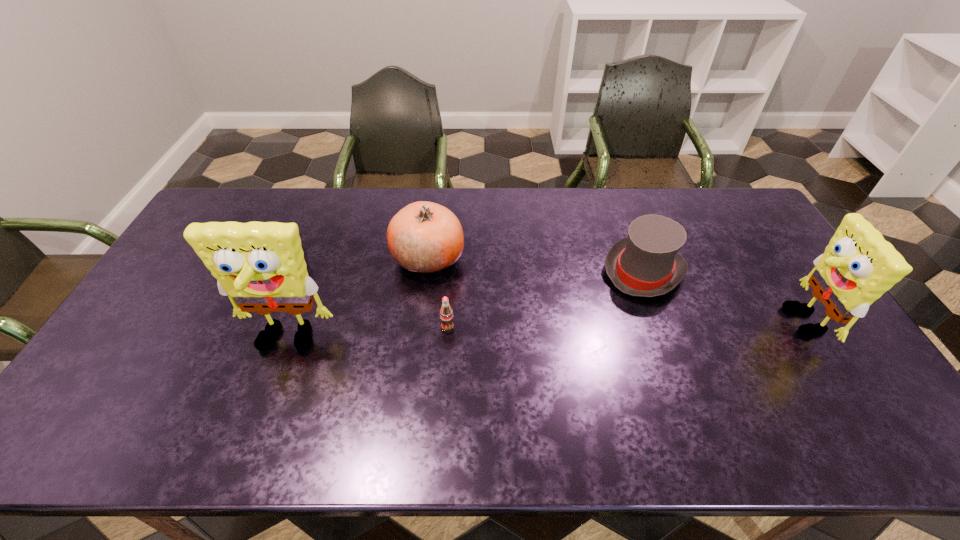
Identify the location of vacant space at the left edge of the desktop. (171, 327).

I want to click on blank space at the right edge, so click(768, 249).

The width and height of the screenshot is (960, 540). In order to click on free space at the far left corner in this screenshot , I will do `click(213, 206)`.

This screenshot has height=540, width=960. In order to click on free space at the near right corner in this screenshot , I will do `click(847, 395)`.

The width and height of the screenshot is (960, 540). What are the coordinates of `free space between the third shortest object and the shorter sponge` in the screenshot? It's located at (721, 296).

Locate an element on the screen. vacant space in between the left sponge and the second object from right to left is located at coordinates (465, 306).

Where is `unoccupied position between the shortest object and the pumpkin`? Image resolution: width=960 pixels, height=540 pixels. unoccupied position between the shortest object and the pumpkin is located at coordinates (352, 264).

Identify the location of vacant area that lies between the dumbbell and the shorter sponge. This screenshot has height=540, width=960. (538, 295).

This screenshot has height=540, width=960. I want to click on vacant area that lies between the shortest object and the soda, so click(362, 299).

Image resolution: width=960 pixels, height=540 pixels. I want to click on vacant point located between the fifth shortest object and the tallest object, so click(542, 332).